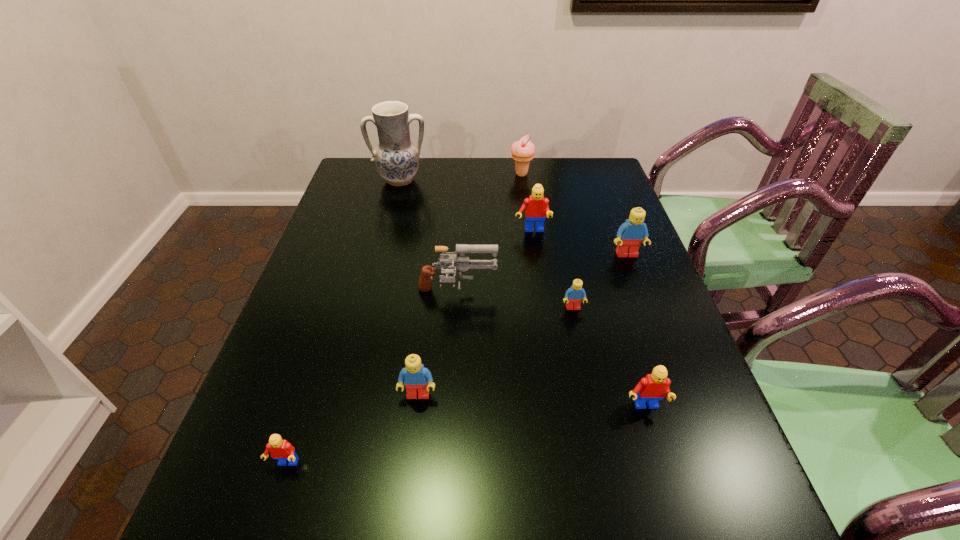
At what (x,y) coordinates should I click in order to perform the action: click on free space that satisfies the following two spatial constraints: 1. on the front-facing side of the biggest red Lego; 2. at the barrel end of the gun. Please return your answer as a coordinate pair (x, y). The width and height of the screenshot is (960, 540). Looking at the image, I should click on (540, 293).

The width and height of the screenshot is (960, 540). What are the coordinates of `vacant area that satisfies the following two spatial constraints: 1. at the barrel end of the gun; 2. on the face of the nearest blue Lego` in the screenshot? It's located at (452, 395).